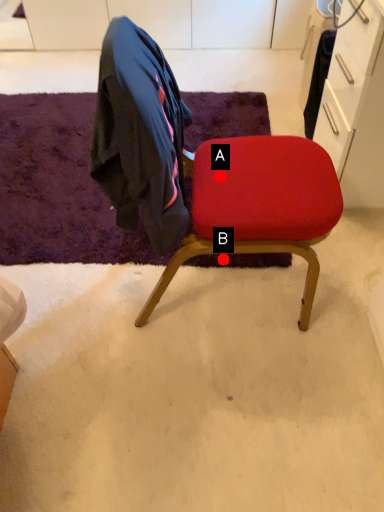
Question: Two points are circled on the image, labeled by A and B beside each circle. Which point is farther from the camera taking this photo?

Choices:
 (A) A is further
 (B) B is further

Answer: (B)